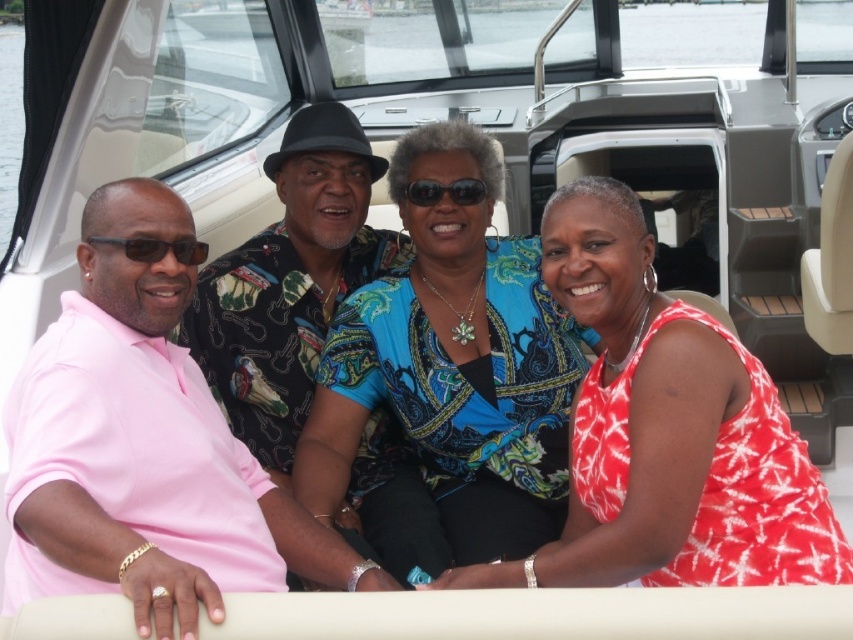
What are the coordinates of the pink cotton polo shirt at left?

The pink cotton polo shirt at left is located at coordinates point [149,449].

You are a photographer trying to capture a group photo of the individuals in the boat cabin. You notice the blue paisley blouse at center and the black plastic sunglasses at center. To ensure both are fully visible in the frame, which object should you prioritize keeping closer to the edge of the photo?

The blue paisley blouse at center might be wider than black plastic sunglasses at center, so prioritize keeping the black plastic sunglasses at center closer to the edge to ensure both fit in the frame.